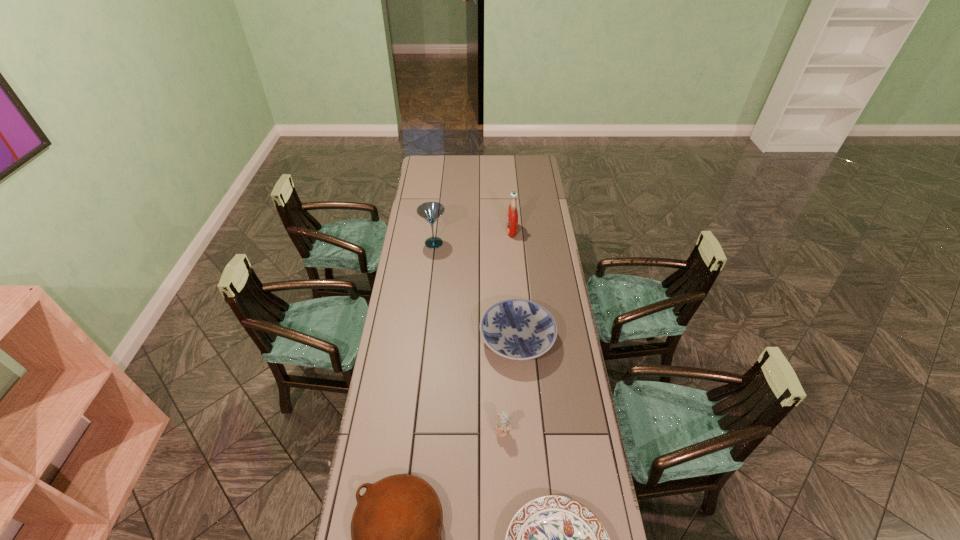
The image size is (960, 540). I want to click on empty space that is in between the fourth farthest object and the martini, so click(x=468, y=337).

This screenshot has height=540, width=960. What are the coordinates of `blank region between the martini and the fourth nearest object` in the screenshot? It's located at (475, 291).

At what (x,y) coordinates should I click in order to perform the action: click on object that is the second closest to the martini. Please return your answer as a coordinate pair (x, y). Looking at the image, I should click on (517, 329).

You are a GUI agent. You are given a task and a screenshot of the screen. Output one action in this format:
    pyautogui.click(x=<x>, y=<y>)
    Task: Click on the object that stands as the third closest to the farthest plate
    
    Given the screenshot: What is the action you would take?
    [396, 526]

At what (x,y) coordinates should I click in order to perform the action: click on the closest plate to the fourth shortest object. Please return your answer as a coordinate pair (x, y). Image resolution: width=960 pixels, height=540 pixels. Looking at the image, I should click on (552, 539).

What are the coordinates of `plate that is the second nearest to the detergent` in the screenshot? It's located at (396, 526).

At what (x,y) coordinates should I click in order to perform the action: click on free space that satisfies the following two spatial constraints: 1. on the front surface of the detergent; 2. on the front-facing side of the third nearest object. Please return your answer as a coordinate pair (x, y). This screenshot has width=960, height=540. Looking at the image, I should click on (528, 431).